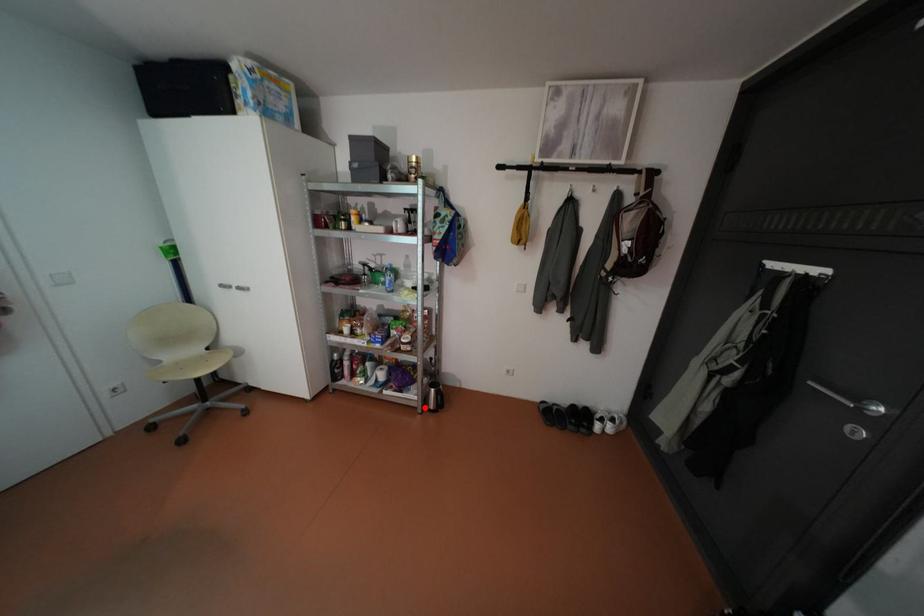
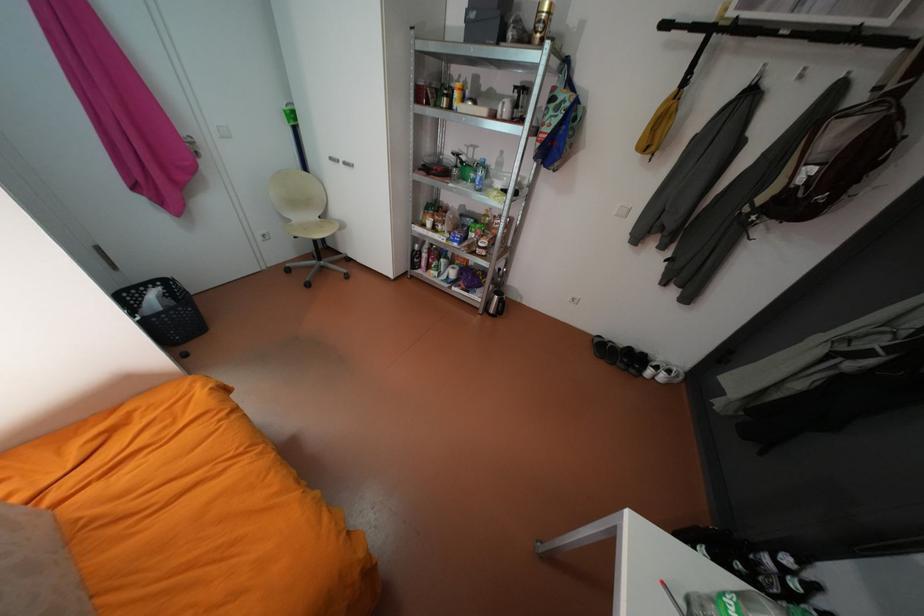
Question: I am providing you with two images of the same scene from different viewpoints. A red point is shown in image1. For the corresponding object point in image2, is it positioned nearer or farther from the camera?

Choices:
 (A) Nearer
 (B) Farther

Answer: (A)